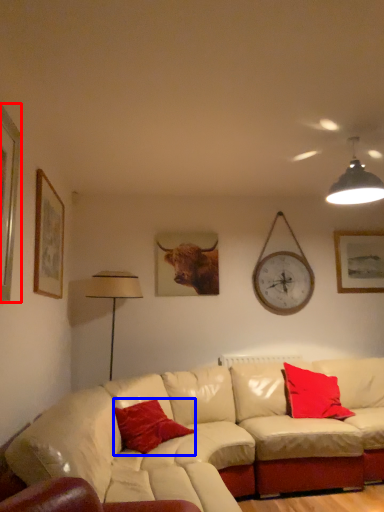
Question: Among these objects, which one is farthest to the camera, picture frame (highlighted by a red box) or pillow (highlighted by a blue box)?

Choices:
 (A) picture frame
 (B) pillow

Answer: (B)